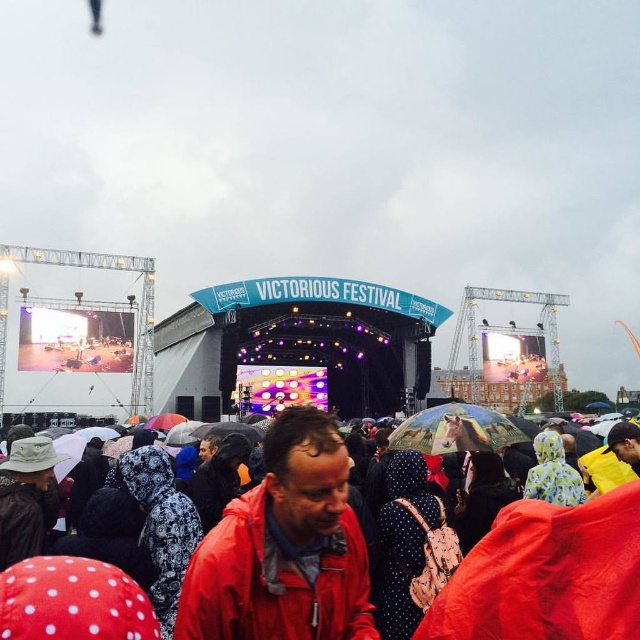
You are a photographer at the Victorious Festival. You need to capture a photo of the red matte jacket at center and the transparent plastic umbrella at center. Which object should you zoom in on to ensure both fit in the frame without cropping?

The red matte jacket at center has a lesser width compared to the transparent plastic umbrella at center, so you should zoom in on the transparent plastic umbrella at center to ensure both fit in the frame without cropping.

From the picture: You are standing at the point marked as point (547, 573) in the image. What is the nearest object to you in the scene?

The nearest object to you at point (547, 573) is the red raincoat at lower center.